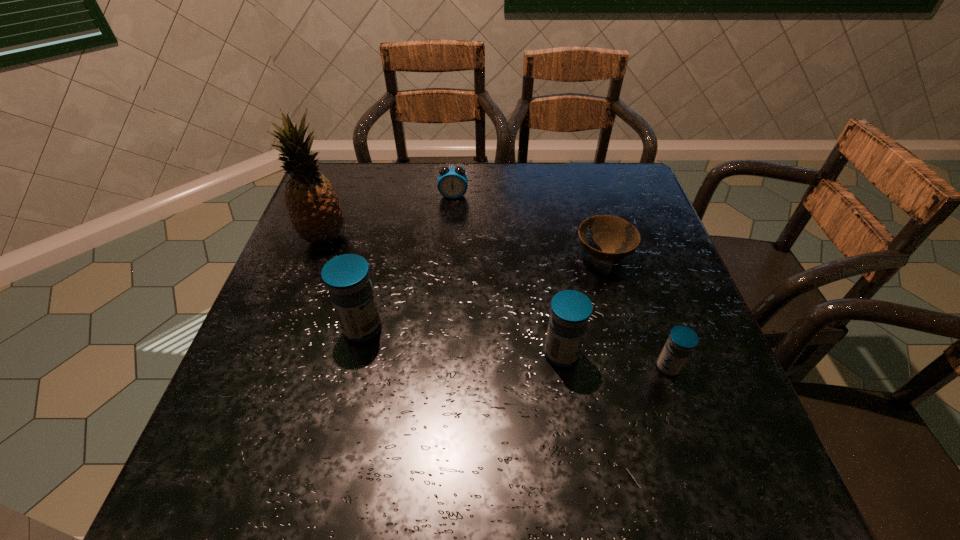
At what (x,y) coordinates should I click in order to perform the action: click on vacant space that satisfies the following two spatial constraints: 1. on the face of the second medicine from right to left; 2. on the right side of the alarm clock. Please return your answer as a coordinate pair (x, y). Image resolution: width=960 pixels, height=540 pixels. Looking at the image, I should click on (443, 354).